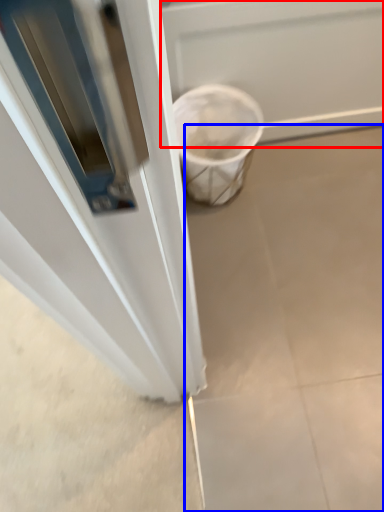
Question: Among these objects, which one is farthest to the camera, screen door (highlighted by a red box) or concrete (highlighted by a blue box)?

Choices:
 (A) screen door
 (B) concrete

Answer: (B)